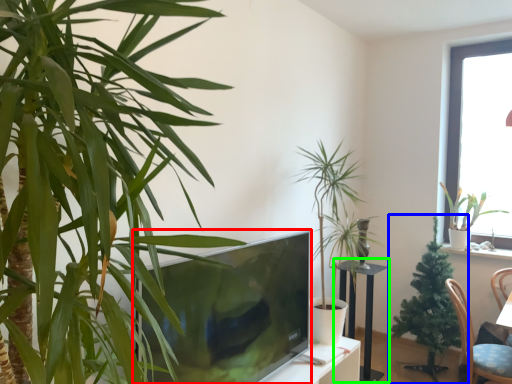
Question: Which is nearer to the television (highlighted by a red box)? houseplant (highlighted by a blue box) or round table (highlighted by a green box).

Choices:
 (A) houseplant
 (B) round table

Answer: (B)